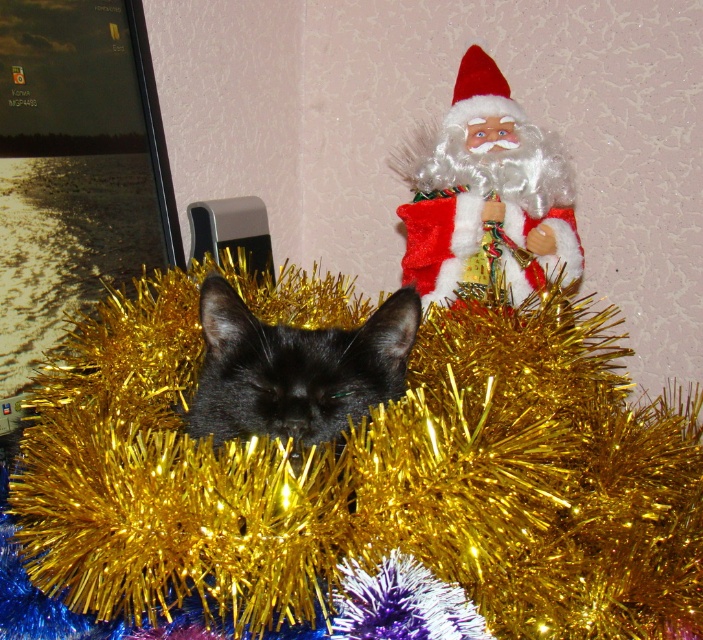
Measure the distance between gold tinsel at center and fuzzy white santa at upper right.

They are 14.90 inches apart.

Does point (96, 435) lie in front of point (467, 252)?

Yes, it is.

Measure the distance between point (574, 616) and camera.

The distance of point (574, 616) from camera is 22.93 inches.

You are a GUI agent. You are given a task and a screenshot of the screen. Output one action in this format:
    pyautogui.click(x=<x>, y=<y>)
    Task: Click on the gold tinsel at center
    The width and height of the screenshot is (703, 640).
    Given the screenshot: What is the action you would take?
    pyautogui.click(x=367, y=477)

Image resolution: width=703 pixels, height=640 pixels. Identify the location of gold tinsel at center. (367, 477).

Which is more to the left, gold tinsel at center or black shiny cat at center?

black shiny cat at center

Which is in front, point (491, 362) or point (278, 336)?

Point (278, 336) is more forward.

At what (x,y) coordinates should I click in order to perform the action: click on gold tinsel at center. Please return your answer as a coordinate pair (x, y). The width and height of the screenshot is (703, 640). Looking at the image, I should click on (367, 477).

Based on the photo, between fuzzy white santa at upper right and black shiny cat at center, which one is positioned lower?

Positioned lower is black shiny cat at center.

Who is higher up, fuzzy white santa at upper right or black shiny cat at center?

fuzzy white santa at upper right

This screenshot has width=703, height=640. Find the location of `fuzzy white santa at upper right`. fuzzy white santa at upper right is located at coordinates (486, 195).